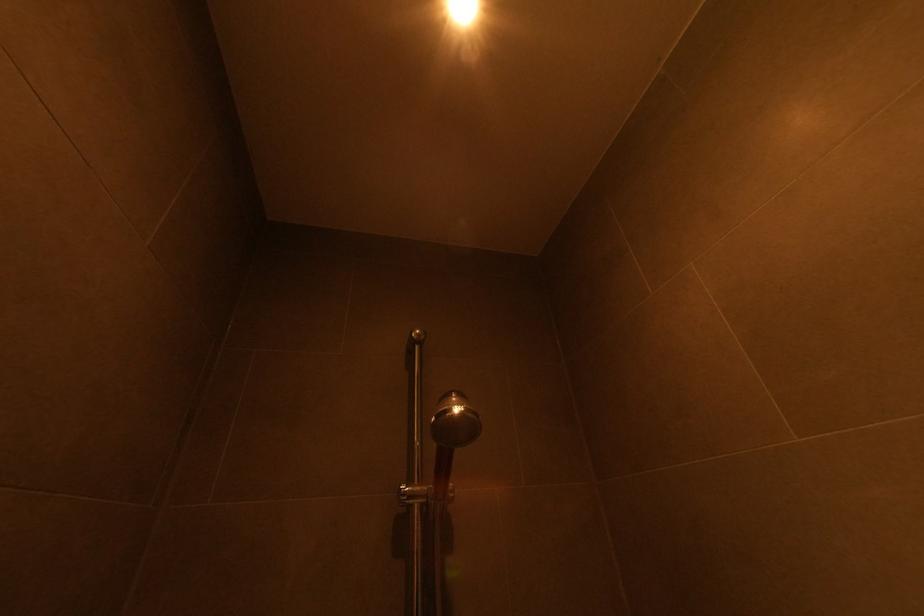
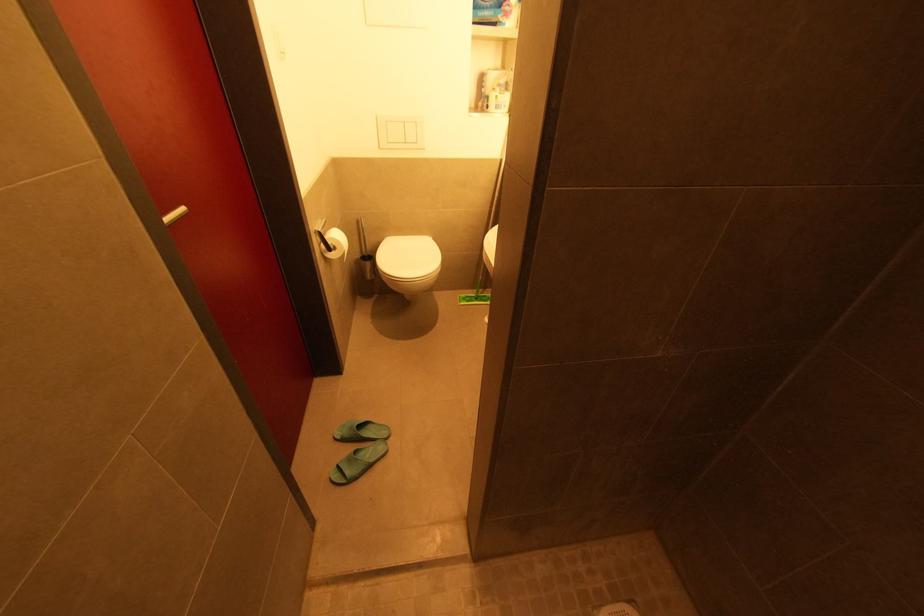
Based on the continuous images, in which direction is the camera rotating?

The camera rotated toward left-down.